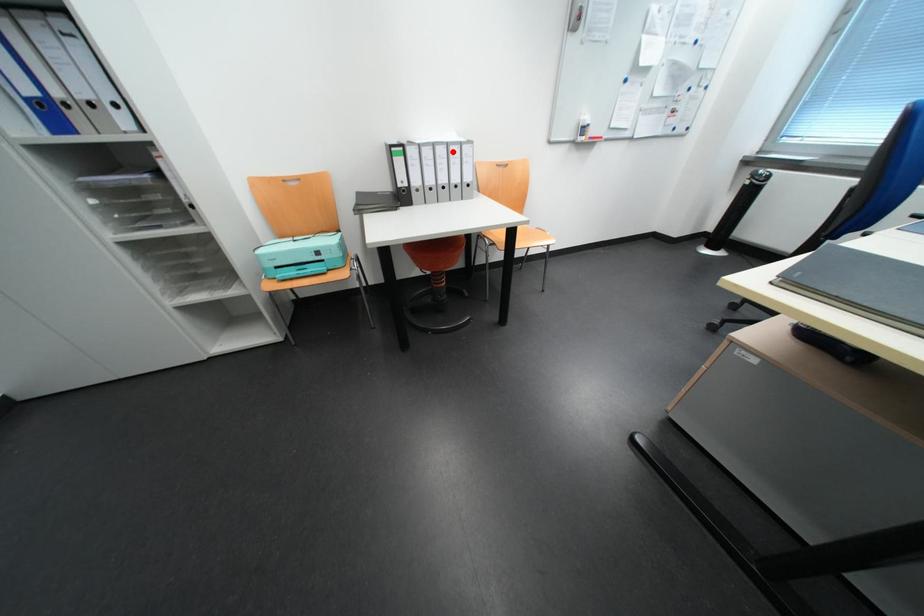
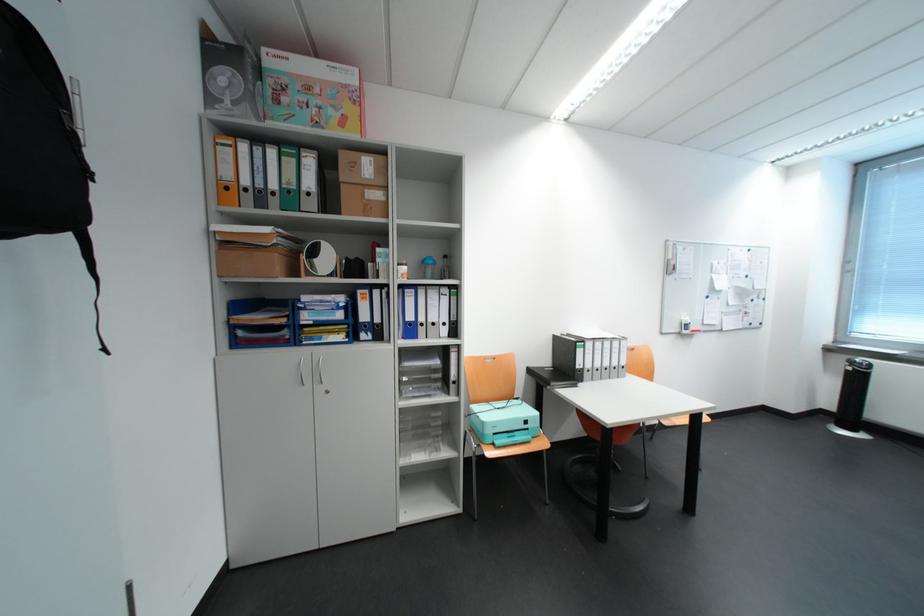
Question: I am providing you with two images of the same scene from different viewpoints. Image1 has a red point marked. In image2, the corresponding 3D location appears at what relative position? Reply with the corresponding letter.

Choices:
 (A) Closer
 (B) Farther

Answer: (B)